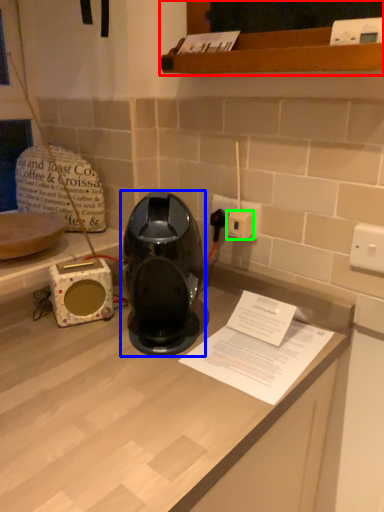
Question: Which is farther away from cabinetry (highlighted by a red box)? home appliance (highlighted by a blue box) or socket (highlighted by a green box)?

Choices:
 (A) home appliance
 (B) socket

Answer: (A)